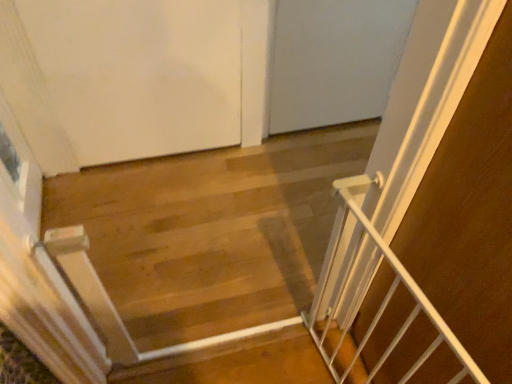
Question: Considering the relative sizes of white matte door at upper left and white metal gate at right in the image provided, is white matte door at upper left bigger than white metal gate at right?

Choices:
 (A) no
 (B) yes

Answer: (B)

Question: Is white matte door at upper left closer to camera compared to white metal gate at right?

Choices:
 (A) yes
 (B) no

Answer: (B)

Question: Is white matte door at upper left turned away from white metal gate at right?

Choices:
 (A) yes
 (B) no

Answer: (B)

Question: From the image's perspective, would you say white matte door at upper left is shown under white metal gate at right?

Choices:
 (A) no
 (B) yes

Answer: (A)

Question: From a real-world perspective, is white matte door at upper left physically above white metal gate at right?

Choices:
 (A) yes
 (B) no

Answer: (A)

Question: Considering the relative sizes of white matte door at upper left and white metal gate at right in the image provided, is white matte door at upper left thinner than white metal gate at right?

Choices:
 (A) yes
 (B) no

Answer: (A)

Question: Does white metal gate at right have a greater width compared to white metal gate at center?

Choices:
 (A) yes
 (B) no

Answer: (A)

Question: From the image's perspective, is white metal gate at right on white metal gate at center?

Choices:
 (A) yes
 (B) no

Answer: (B)

Question: Is white metal gate at right taller than white metal gate at center?

Choices:
 (A) yes
 (B) no

Answer: (B)

Question: From a real-world perspective, is white metal gate at right on top of white metal gate at center?

Choices:
 (A) no
 (B) yes

Answer: (B)

Question: Is white metal gate at right in front of white metal gate at center?

Choices:
 (A) yes
 (B) no

Answer: (A)

Question: From the image's perspective, does white metal gate at right appear lower than white metal gate at center?

Choices:
 (A) no
 (B) yes

Answer: (B)

Question: Does white metal gate at center contain white matte door at upper left?

Choices:
 (A) no
 (B) yes

Answer: (A)